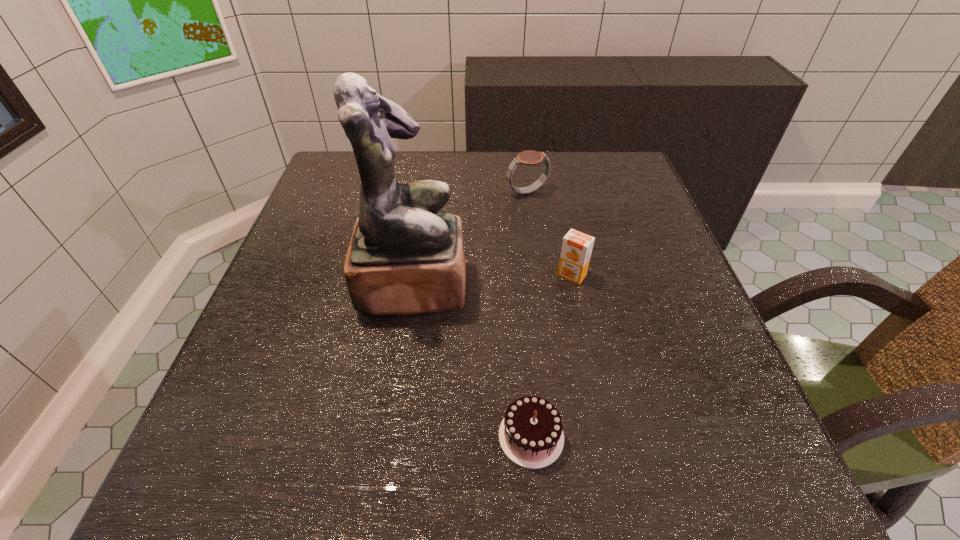
Where is `vacant space that satisfies the following two spatial constraints: 1. on the front side of the orange juice; 2. in a relaxed pose on the leftmost object`? This screenshot has width=960, height=540. vacant space that satisfies the following two spatial constraints: 1. on the front side of the orange juice; 2. in a relaxed pose on the leftmost object is located at coordinates (574, 284).

Locate an element on the screen. free region that satisfies the following two spatial constraints: 1. on the front side of the orange juice; 2. in a relaxed pose on the tallest object is located at coordinates (574, 284).

Locate an element on the screen. The height and width of the screenshot is (540, 960). free space that satisfies the following two spatial constraints: 1. in a relaxed pose on the leftmost object; 2. on the left side of the shortest object is located at coordinates (392, 436).

Image resolution: width=960 pixels, height=540 pixels. Find the location of `vacant space that satisfies the following two spatial constraints: 1. on the front side of the farthest object; 2. in a relaxed pose on the sculpture`. vacant space that satisfies the following two spatial constraints: 1. on the front side of the farthest object; 2. in a relaxed pose on the sculpture is located at coordinates (540, 284).